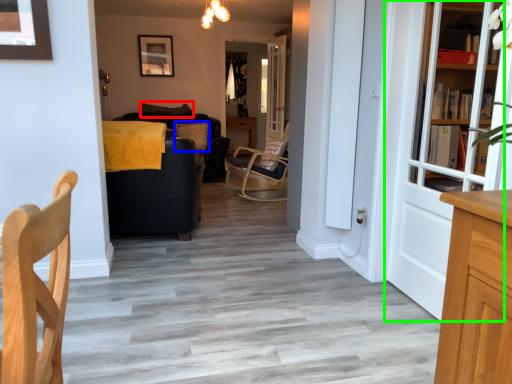
Question: Which object is the farthest from pillow (highlighted by a red box)? Choose among these: pillow (highlighted by a blue box) or door (highlighted by a green box).

Choices:
 (A) pillow
 (B) door

Answer: (B)